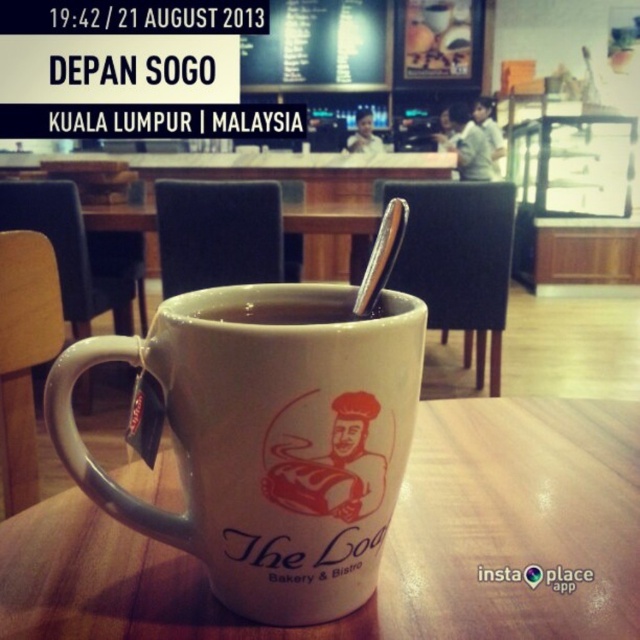
Is point (284, 330) in front of point (202, 312)?

Yes, point (284, 330) is in front of point (202, 312).

Does point (230, 580) come in front of point (252, 314)?

Yes.

Identify the location of white matte mug at center. (268, 442).

Can you confirm if white wood table at center is positioned to the left of white matte mug at center?

In fact, white wood table at center is to the right of white matte mug at center.

In order to click on white wood table at center in this screenshot , I will do point(385,541).

What are the coordinates of `white wood table at center` in the screenshot? It's located at (385, 541).

Is white wood table at center taller than white matte cup at center?

Correct, white wood table at center is much taller as white matte cup at center.

Who is shorter, white wood table at center or white matte cup at center?

Standing shorter between the two is white matte cup at center.

Identify the location of white wood table at center. (385, 541).